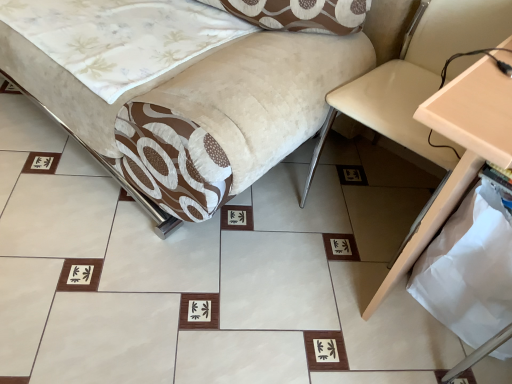
Where is `free region on the left part of beige wood table at right`? The height and width of the screenshot is (384, 512). free region on the left part of beige wood table at right is located at coordinates (262, 296).